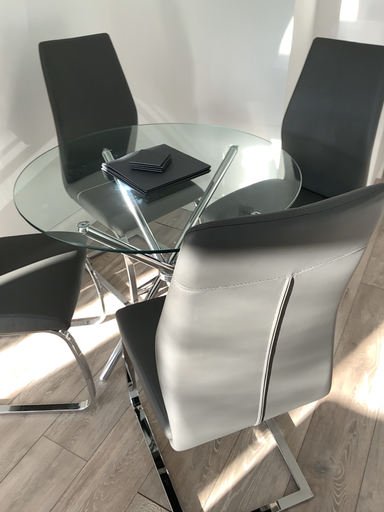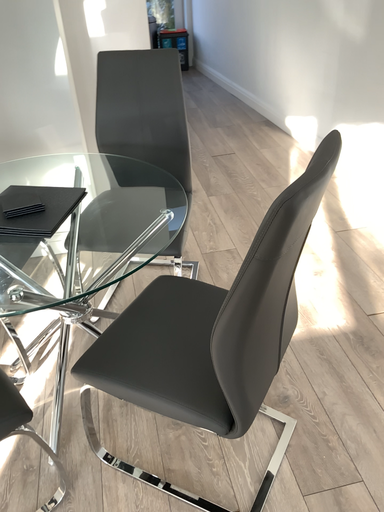
Question: How did the camera likely rotate when shooting the video?

Choices:
 (A) rotated right
 (B) rotated left

Answer: (A)